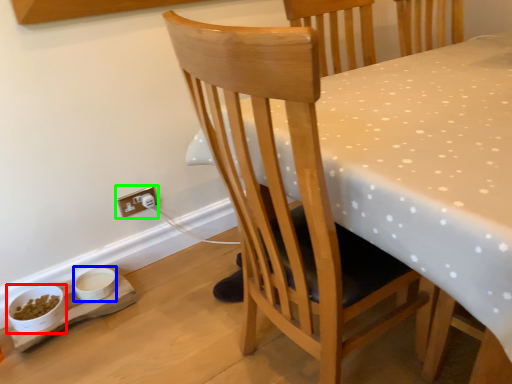
Question: Which object is positioned closest to bowl (highlighted by a red box)? Select from bowl (highlighted by a blue box) and electric outlet (highlighted by a green box).

Choices:
 (A) bowl
 (B) electric outlet

Answer: (A)